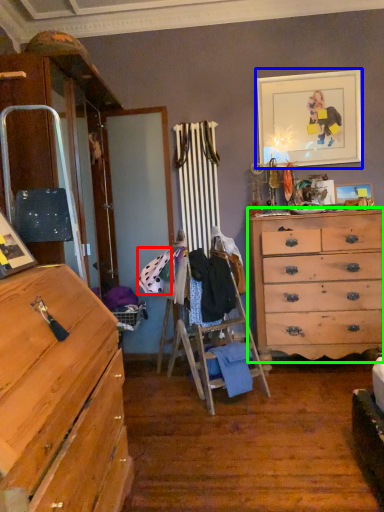
Question: Estimate the real-world distances between objects in this image. Which object is closer to clothing (highlighted by a red box), picture frame (highlighted by a blue box) or chest of drawers (highlighted by a green box)?

Choices:
 (A) picture frame
 (B) chest of drawers

Answer: (B)